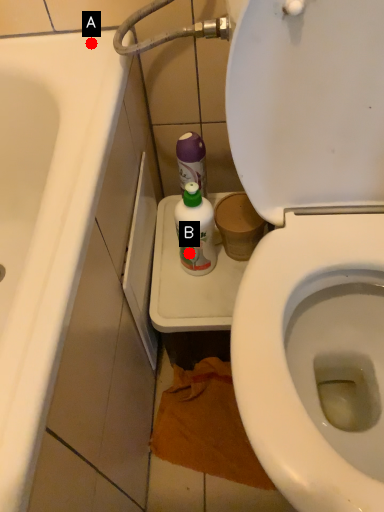
Question: Two points are circled on the image, labeled by A and B beside each circle. Which point is closer to the camera taking this photo?

Choices:
 (A) A is closer
 (B) B is closer

Answer: (A)